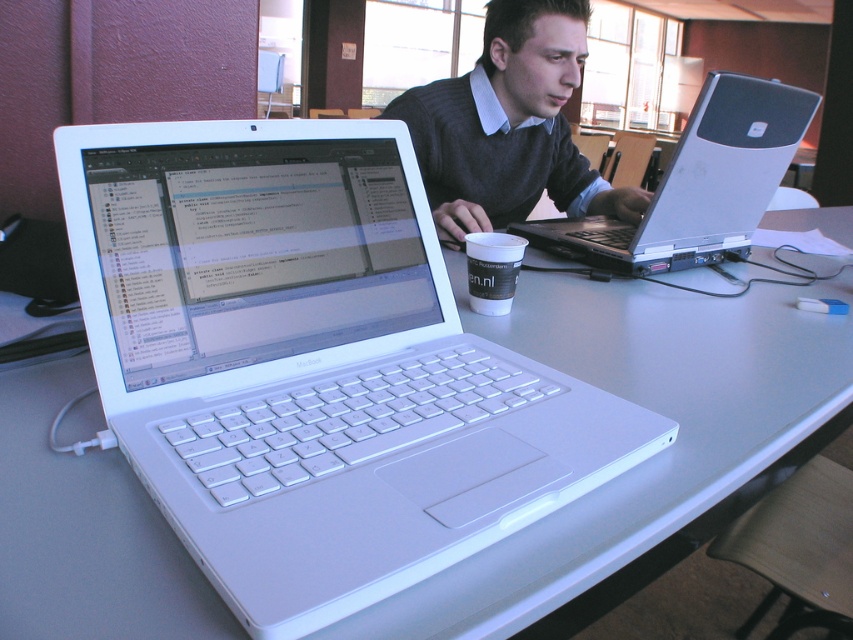
Is point (550, 16) behind point (509, 257)?

Yes, point (550, 16) is behind point (509, 257).

Consider the image. Does dark gray sweater at center come behind white paper cup at center?

That is True.

What do you see at coordinates (509, 125) in the screenshot? I see `dark gray sweater at center` at bounding box center [509, 125].

The width and height of the screenshot is (853, 640). Find the location of `dark gray sweater at center`. dark gray sweater at center is located at coordinates (509, 125).

Which is below, white plastic table at center or dark gray sweater at center?

white plastic table at center is lower down.

Is white plastic table at center to the right of dark gray sweater at center from the viewer's perspective?

Incorrect, white plastic table at center is not on the right side of dark gray sweater at center.

The image size is (853, 640). I want to click on white plastic table at center, so pos(648,458).

Is white plastic table at center smaller than silver metallic laptop at center?

No.

Between white plastic table at center and silver metallic laptop at center, which one is positioned lower?

white plastic table at center is lower down.

The height and width of the screenshot is (640, 853). Find the location of `white plastic table at center`. white plastic table at center is located at coordinates (648, 458).